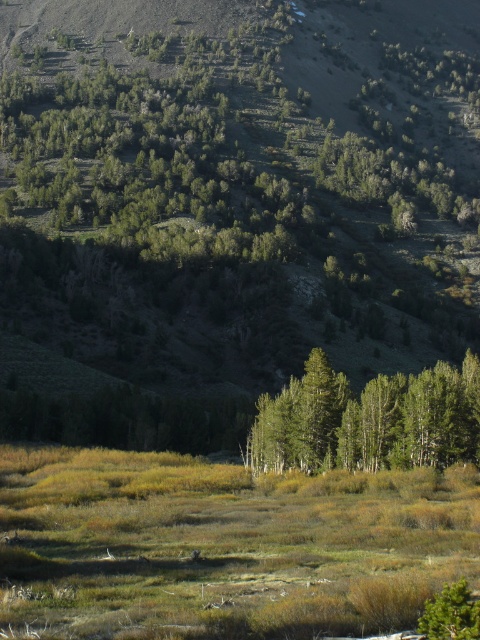
Is green matte trees at center positioned in front of green matte tree at lower right?

That is False.

This screenshot has width=480, height=640. What do you see at coordinates (369, 420) in the screenshot? I see `green matte trees at center` at bounding box center [369, 420].

You are a GUI agent. You are given a task and a screenshot of the screen. Output one action in this format:
    pyautogui.click(x=<x>, y=<y>)
    Task: Click on the green matte trees at center
    The image size is (480, 640).
    Given the screenshot: What is the action you would take?
    pyautogui.click(x=369, y=420)